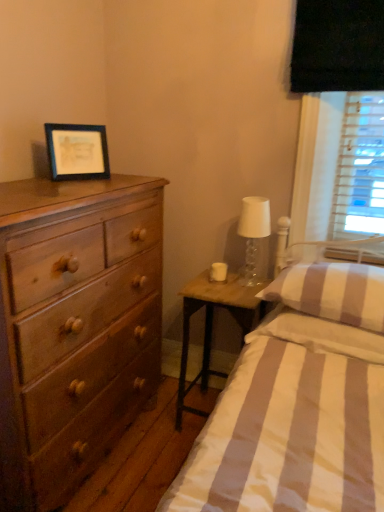
Question: Does translucent glass lampshade at right have a greater height compared to woodennightstand at right?

Choices:
 (A) yes
 (B) no

Answer: (B)

Question: Is translucent glass lampshade at right turned away from woodennightstand at right?

Choices:
 (A) yes
 (B) no

Answer: (B)

Question: Is translucent glass lampshade at right aimed at woodennightstand at right?

Choices:
 (A) yes
 (B) no

Answer: (B)

Question: Does translucent glass lampshade at right appear on the left side of woodennightstand at right?

Choices:
 (A) no
 (B) yes

Answer: (A)

Question: From a real-world perspective, is translucent glass lampshade at right positioned over woodennightstand at right based on gravity?

Choices:
 (A) yes
 (B) no

Answer: (A)

Question: Is matte brown dresser at left taller or shorter than striped cotton bed at center?

Choices:
 (A) tall
 (B) short

Answer: (A)

Question: From the image's perspective, relative to striped cotton bed at center, is matte brown dresser at left above or below?

Choices:
 (A) below
 (B) above

Answer: (B)

Question: Considering their positions, is matte brown dresser at left located in front of or behind striped cotton bed at center?

Choices:
 (A) front
 (B) behind

Answer: (B)

Question: Is matte brown dresser at left spatially inside striped cotton bed at center, or outside of it?

Choices:
 (A) outside
 (B) inside

Answer: (A)

Question: Based on their sizes in the image, would you say striped fabric pillow at right, the 2th pillow in the top-to-bottom sequence, is bigger or smaller than white glass candle holder at right?

Choices:
 (A) big
 (B) small

Answer: (A)

Question: Is striped fabric pillow at right, the 2th pillow in the top-to-bottom sequence, spatially inside white glass candle holder at right, or outside of it?

Choices:
 (A) outside
 (B) inside

Answer: (A)

Question: From the image's perspective, is striped fabric pillow at right, the 2th pillow in the top-to-bottom sequence, positioned above or below white glass candle holder at right?

Choices:
 (A) below
 (B) above

Answer: (A)

Question: In terms of width, does striped fabric pillow at right, the 2th pillow in the top-to-bottom sequence, look wider or thinner when compared to white glass candle holder at right?

Choices:
 (A) wide
 (B) thin

Answer: (A)

Question: Would you say woodennightstand at right is inside or outside translucent glass lampshade at right?

Choices:
 (A) inside
 (B) outside

Answer: (B)

Question: Is woodennightstand at right bigger or smaller than translucent glass lampshade at right?

Choices:
 (A) big
 (B) small

Answer: (A)